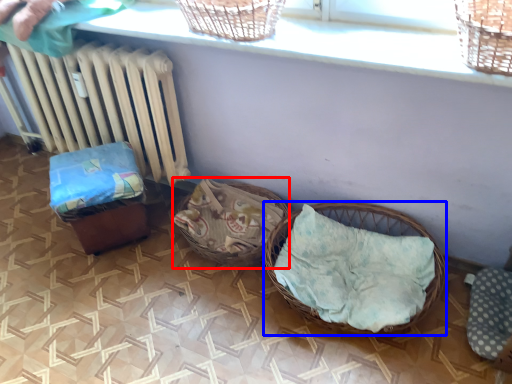
Question: Which point is closer to the camera, basket (highlighted by a red box) or picnic basket (highlighted by a blue box)?

Choices:
 (A) basket
 (B) picnic basket

Answer: (B)